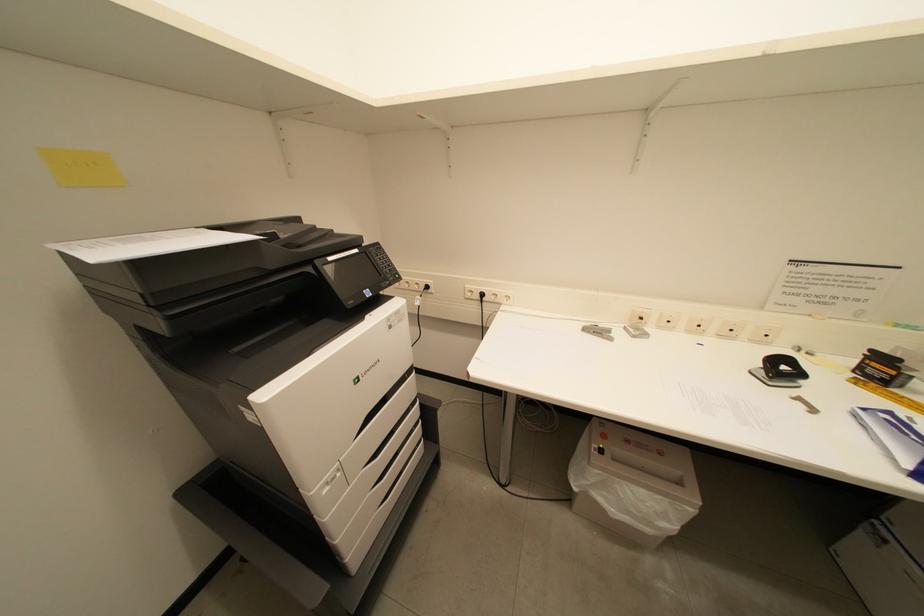
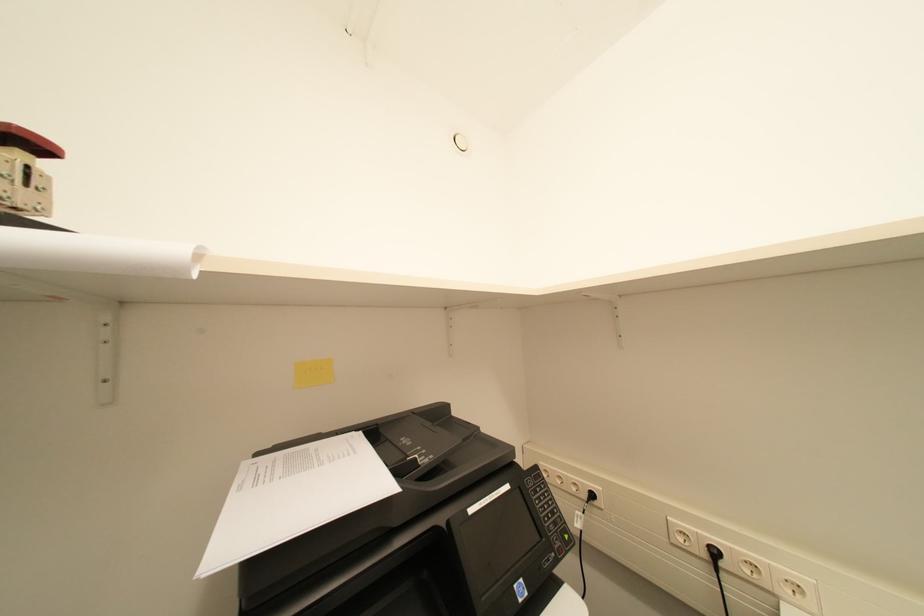
First-person continuous shooting, in which direction is the camera rotating?

The camera rotated toward left-up.